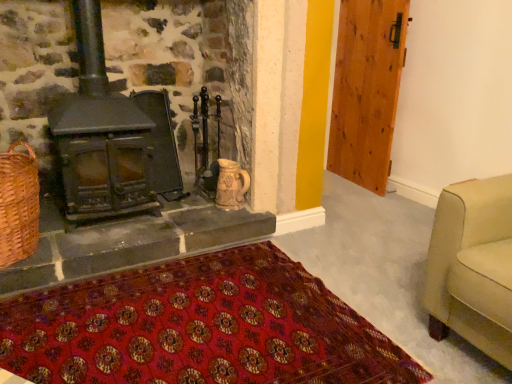
Find the location of `free space in front of wooden door at right`. free space in front of wooden door at right is located at coordinates (372, 199).